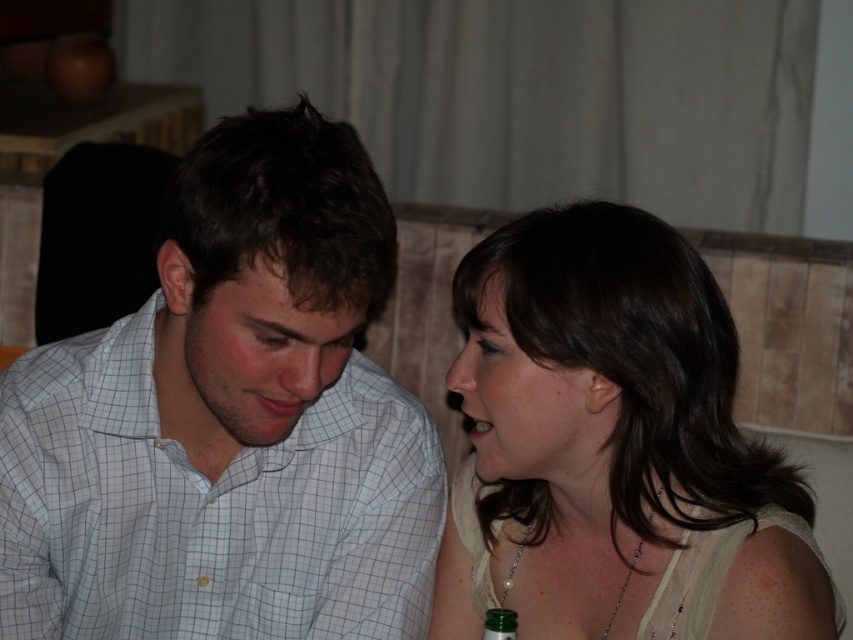
You are a photographer trying to capture a candid shot of the two people in the scene. You want to ensure both the white checkered shirt at center and the green glass bottle at lower center are clearly visible in the frame. Given their sizes, which object might require you to adjust your camera angle to avoid it being too small in the photo?

The green glass bottle at lower center might require adjusting the camera angle because it is smaller in size compared to the white checkered shirt at center, so it could appear too small in the photo if not framed properly.

You are a photographer adjusting the lighting for a portrait. You notice the white checkered shirt at center and the matte white blouse at center. Which clothing item should you focus on to ensure proper exposure since it is positioned higher in the frame?

The white checkered shirt at center is located above the matte white blouse at center, so you should focus on the white checkered shirt at center for proper exposure as it is higher in the frame.

You are standing in front of the image and want to touch the two points marked in the scene. Which point, point [283,497] or point [461,564], is closer to you?

Point [283,497] is closer to the viewer than point [461,564].